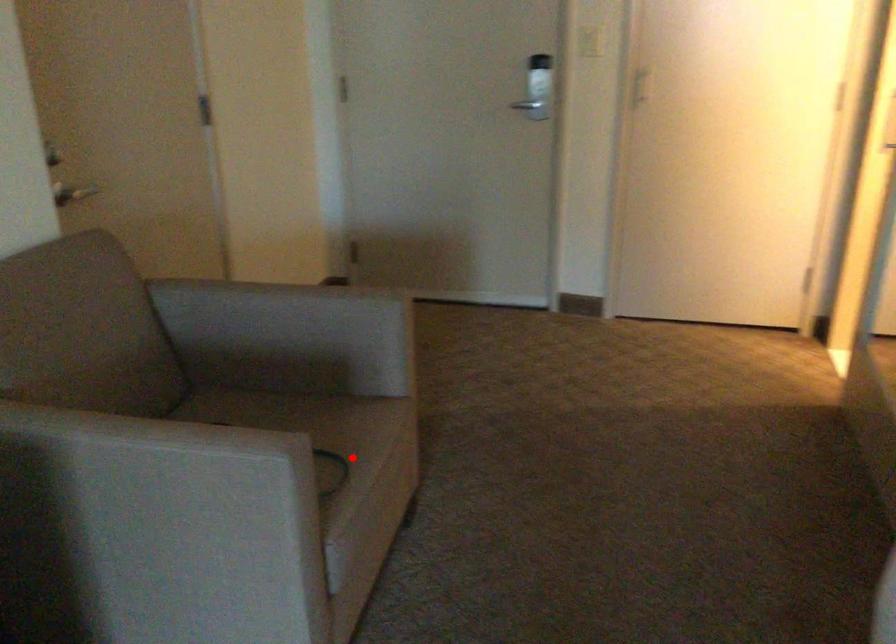
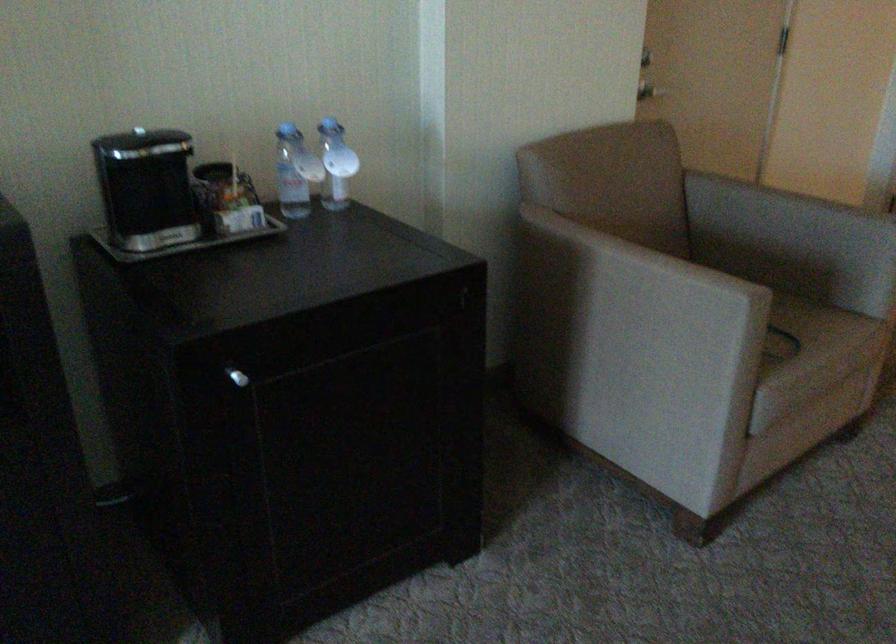
Find the pixel in the second image that matches the highlighted location in the first image.

(811, 335)